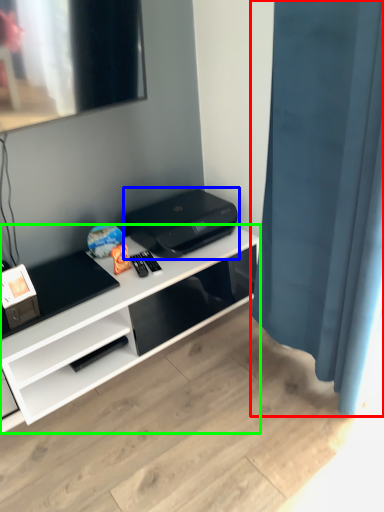
Question: Which object is the closest to the shower curtain (highlighted by a red box)? Choose among these: printer (highlighted by a blue box) or desk (highlighted by a green box).

Choices:
 (A) printer
 (B) desk

Answer: (A)